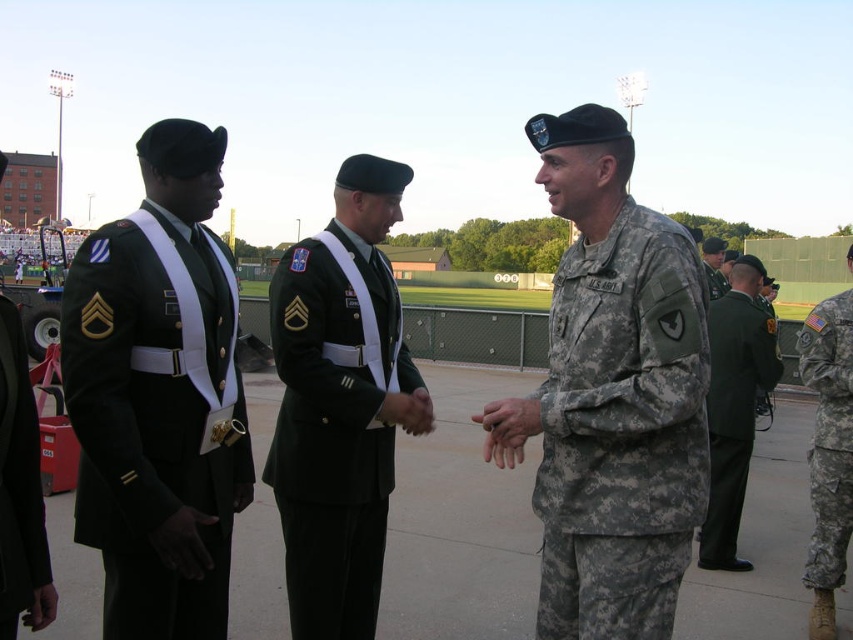
Is shiny black uniform at left positioned before camouflage uniform at center?

Yes, it is in front of camouflage uniform at center.

Does shiny black uniform at left appear on the right side of camouflage uniform at center?

No, shiny black uniform at left is not to the right of camouflage uniform at center.

Find the location of a particular element. The width and height of the screenshot is (853, 640). shiny black uniform at left is located at coordinates (155, 420).

Which is more to the right, shiny black uniform at left or dark green fabric uniform at left?

shiny black uniform at left is more to the right.

Is point (173, 627) closer to viewer compared to point (30, 512)?

No, it is behind (30, 512).

What do you see at coordinates (155, 420) in the screenshot?
I see `shiny black uniform at left` at bounding box center [155, 420].

Where is `shiny black uniform at left`? shiny black uniform at left is located at coordinates (155, 420).

Is point (32, 432) behind point (704, 243)?

No, (32, 432) is closer to viewer.

Is dark green fabric uniform at left smaller than camouflage uniform at center?

Correct, dark green fabric uniform at left occupies less space than camouflage uniform at center.

Measure the distance between dark green fabric uniform at left and camera.

A distance of 2.03 meters exists between dark green fabric uniform at left and camera.

At what (x,y) coordinates should I click in order to perform the action: click on dark green fabric uniform at left. Please return your answer as a coordinate pair (x, y). The height and width of the screenshot is (640, 853). Looking at the image, I should click on (20, 490).